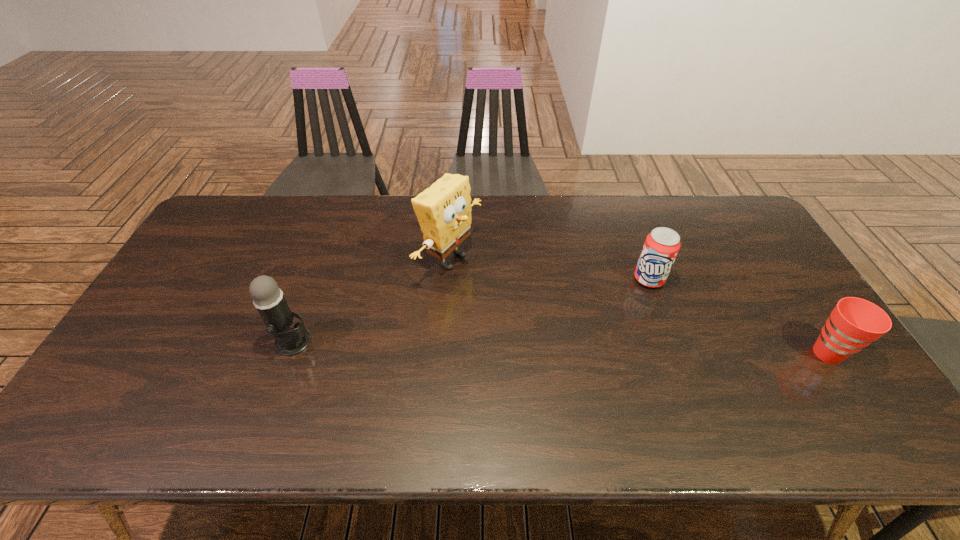
You are a GUI agent. You are given a task and a screenshot of the screen. Output one action in this format:
    pyautogui.click(x=<x>, y=<y>)
    Task: Click on the free location located 0.050m on the surface of the second object from right to left
    The image size is (960, 540).
    Given the screenshot: What is the action you would take?
    pyautogui.click(x=636, y=299)

Find the location of a particular element. blank space located on the surface of the second object from right to left is located at coordinates (605, 347).

Where is `object that is at the far edge`? object that is at the far edge is located at coordinates (444, 210).

This screenshot has width=960, height=540. I want to click on object that is at the near edge, so click(x=854, y=323).

You are a GUI agent. You are given a task and a screenshot of the screen. Output one action in this format:
    pyautogui.click(x=<x>, y=<y>)
    Task: Click on the object that is positioned at the right edge
    Image resolution: width=960 pixels, height=540 pixels.
    Given the screenshot: What is the action you would take?
    pyautogui.click(x=854, y=323)

Image resolution: width=960 pixels, height=540 pixels. In order to click on object located in the near right corner section of the desktop in this screenshot , I will do `click(854, 323)`.

In the image, there is a desktop. At what (x,y) coordinates should I click in order to perform the action: click on vacant space at the far edge. Please return your answer as a coordinate pair (x, y). Image resolution: width=960 pixels, height=540 pixels. Looking at the image, I should click on (579, 219).

At what (x,y) coordinates should I click in order to perform the action: click on vacant space at the near edge of the desktop. Please return your answer as a coordinate pair (x, y). The width and height of the screenshot is (960, 540). Looking at the image, I should click on (x=242, y=380).

In the image, there is a desktop. Identify the location of vacant space at the left edge. This screenshot has width=960, height=540. (213, 285).

Locate an element on the screen. The height and width of the screenshot is (540, 960). vacant space at the right edge is located at coordinates (788, 339).